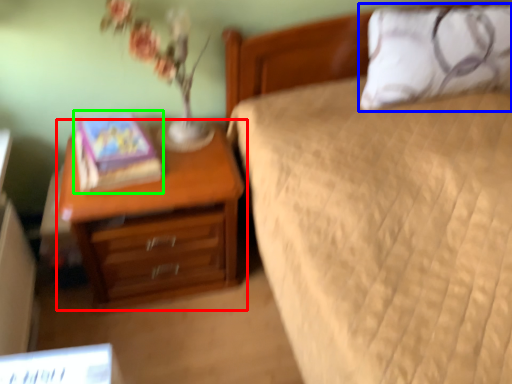
Question: Which object is the closest to the nightstand (highlighted by a red box)? Choose among these: pillow (highlighted by a blue box) or book (highlighted by a green box).

Choices:
 (A) pillow
 (B) book

Answer: (B)